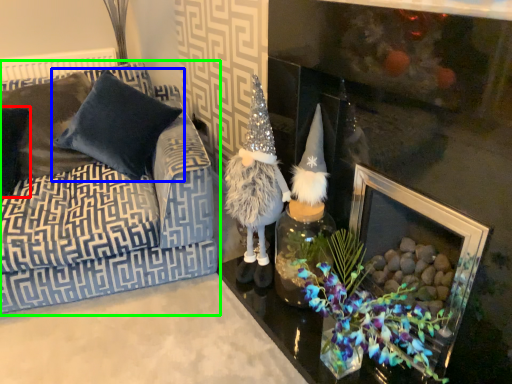
Question: Estimate the real-world distances between objects in this image. Which object is farther from pillow (highlighted by a red box), pillow (highlighted by a blue box) or studio couch (highlighted by a green box)?

Choices:
 (A) pillow
 (B) studio couch

Answer: (B)